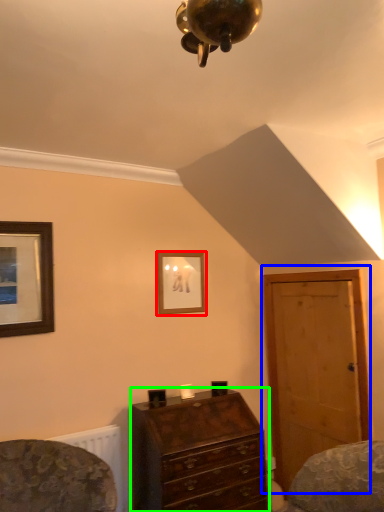
Question: Which object is positioned farthest from picture frame (highlighted by a red box)? Select from door (highlighted by a blue box) and chest of drawers (highlighted by a green box).

Choices:
 (A) door
 (B) chest of drawers

Answer: (B)